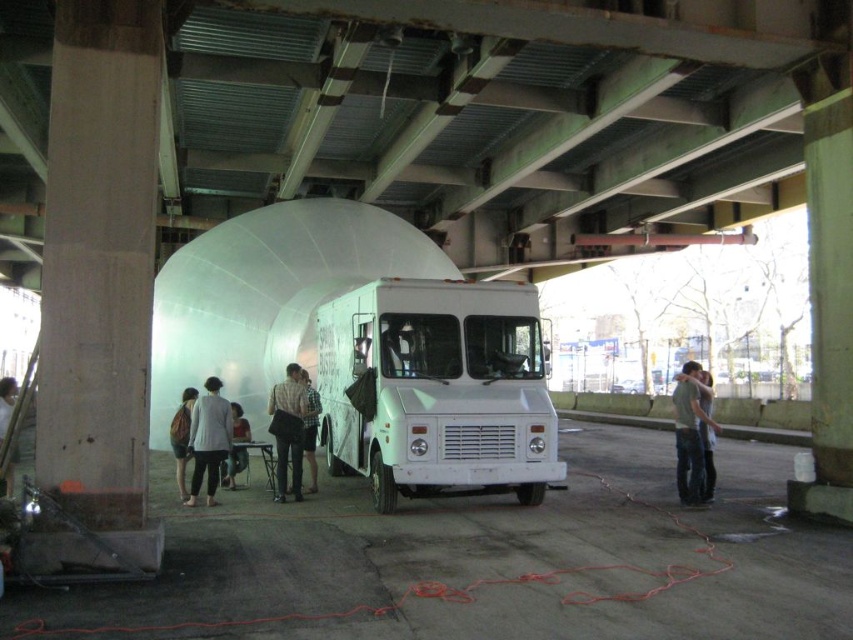
You are observing a group of people under an overpass. You notice a gray cotton shirt at center and a light brown leather jacket at center. Which clothing item is positioned lower on the person?

The gray cotton shirt at center is located below the light brown leather jacket at center, so the gray cotton shirt at center is positioned lower.

You are a pedestrian standing in front of the white food truck parked beneath the bridge. You notice two people wearing a gray cotton shirt at center and a light brown leather jacket at center. Which person is positioned more to your right?

The gray cotton shirt at center is positioned more to the right compared to the light brown leather jacket at center, so the person wearing the gray cotton shirt at center is more to your right.

You are standing at the point marked as point (437, 388). Which object is exactly at your current location?

The white matte food truck at center is exactly at point (437, 388).